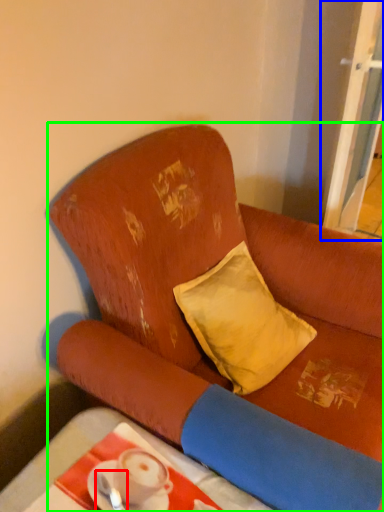
Question: Which object is the closest to the tableware (highlighted by a red box)? Choose among these: screen door (highlighted by a blue box) or studio couch (highlighted by a green box).

Choices:
 (A) screen door
 (B) studio couch

Answer: (B)